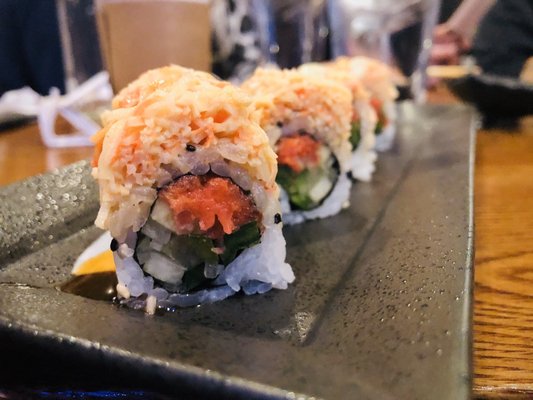
I want to click on wooden table, so click(x=496, y=230).